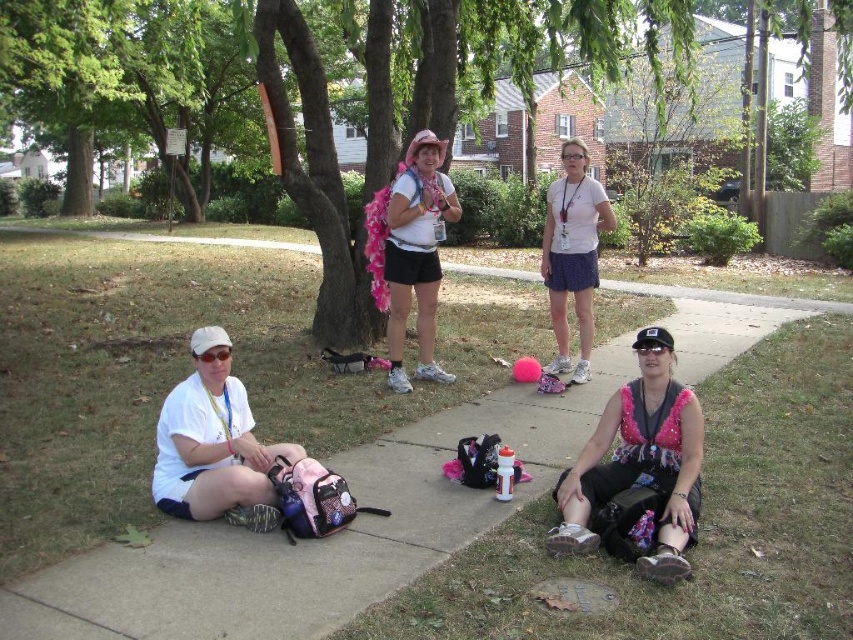
You are a photographer trying to capture a photo of the scene. You want to ensure that the green grass at lower right and the pink feather boa at center are both visible in your frame. Based on their positions, which object is closer to the edge of the frame?

The green grass at lower right is closer to the edge of the frame because it is positioned at the lower right corner, while the pink feather boa at center is centrally located.

You are a delivery person who needs to place a heavy box on the surface that can support more weight. Based on the scene, which object between the concrete sidewalk at center and the pink feather boa at center would be the best choice for placing the box?

The concrete sidewalk at center has a larger size compared to the pink feather boa at center, so the concrete sidewalk at center would be the best choice to place the heavy box as it can support more weight.

Looking at the scene, which object takes up more space in the image? Mention both the green leafy tree at center and the pink sequined top at lower right in your answer.

The green leafy tree at center takes up more space in the image than the pink sequined top at lower right because it is bigger.